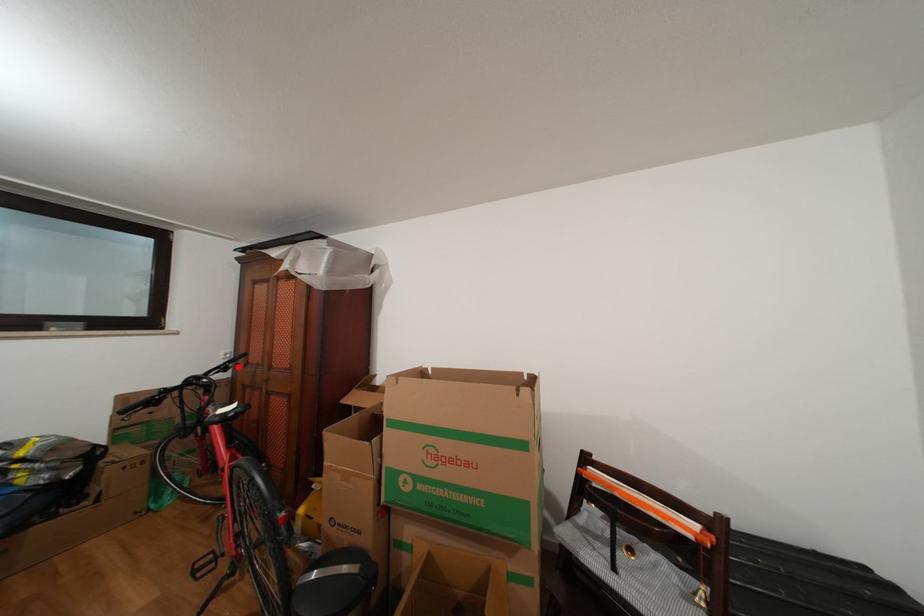
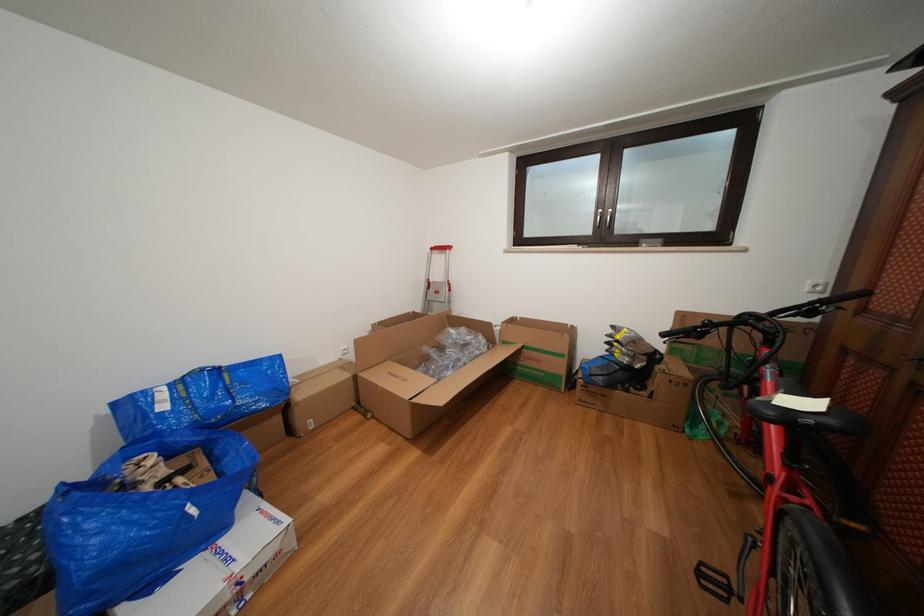
The point at the highlighted location is marked in the first image. Where is the corresponding point in the second image?

(831, 307)